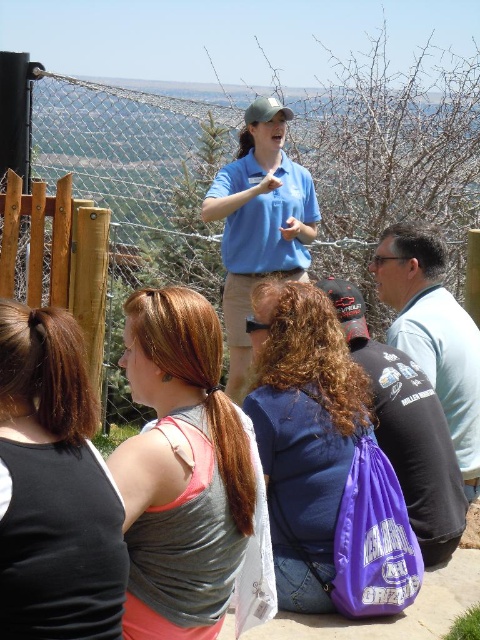
You are a photographer trying to capture the guide in the scene. The guide is standing between two points marked in the image. Which point, point (x=164, y=554) or point (x=236, y=266), is closer to the camera where you are standing?

Point (x=164, y=554) is closer to the camera than point (x=236, y=266), so you should focus on that point to capture the guide properly.

You are part of a tour group and notice two items in the scene. One is a matte gray tank top at center and the other is a purple fabric bag at center. Which item is positioned closer to you?

The matte gray tank top at center is closer to the viewer than the purple fabric bag at center.

You are standing at the center of the scene and want to place a new object at the exact location of the purple fabric backpack at center. What are the coordinates where you should place it?

The coordinates for the purple fabric backpack at center are at point (303, 432).